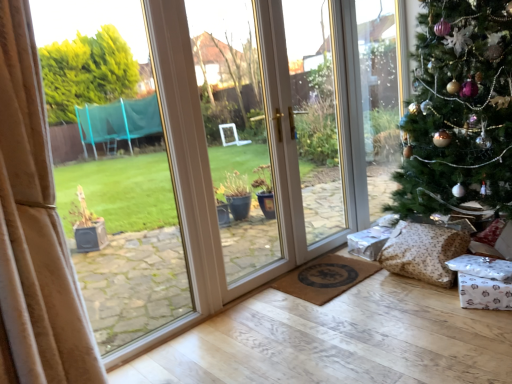
Question: From the image's perspective, does green textured christmas tree at right appear higher than brown textured doormat at lower center?

Choices:
 (A) yes
 (B) no

Answer: (A)

Question: Could you tell me if green textured christmas tree at right is facing brown textured doormat at lower center?

Choices:
 (A) no
 (B) yes

Answer: (A)

Question: Can you confirm if green textured christmas tree at right is bigger than brown textured doormat at lower center?

Choices:
 (A) yes
 (B) no

Answer: (A)

Question: From the image's perspective, is green textured christmas tree at right below brown textured doormat at lower center?

Choices:
 (A) no
 (B) yes

Answer: (A)

Question: Considering the relative positions of green textured christmas tree at right and brown textured doormat at lower center in the image provided, is green textured christmas tree at right to the right of brown textured doormat at lower center from the viewer's perspective?

Choices:
 (A) no
 (B) yes

Answer: (B)

Question: From the image's perspective, is green textured christmas tree at right positioned above or below brown textured pillow at lower right?

Choices:
 (A) above
 (B) below

Answer: (A)

Question: Is point (503, 48) closer or farther from the camera than point (394, 235)?

Choices:
 (A) closer
 (B) farther

Answer: (A)

Question: Choose the correct answer: Is green textured christmas tree at right inside brown textured pillow at lower right or outside it?

Choices:
 (A) outside
 (B) inside

Answer: (A)

Question: Considering the positions of green textured christmas tree at right and brown textured pillow at lower right in the image, is green textured christmas tree at right wider or thinner than brown textured pillow at lower right?

Choices:
 (A) thin
 (B) wide

Answer: (B)

Question: Looking at their shapes, would you say green textured christmas tree at right is wider or thinner than brown textured doormat at lower center?

Choices:
 (A) wide
 (B) thin

Answer: (A)

Question: From a real-world perspective, relative to brown textured doormat at lower center, is green textured christmas tree at right vertically above or below?

Choices:
 (A) above
 (B) below

Answer: (A)

Question: Looking at the image, does green textured christmas tree at right seem bigger or smaller compared to brown textured doormat at lower center?

Choices:
 (A) small
 (B) big

Answer: (B)

Question: Relative to brown textured doormat at lower center, is green textured christmas tree at right in front or behind?

Choices:
 (A) behind
 (B) front

Answer: (B)

Question: Is brown textured doormat at lower center to the left or to the right of green textured christmas tree at right in the image?

Choices:
 (A) right
 (B) left

Answer: (B)

Question: Is point (362, 271) closer or farther from the camera than point (434, 99)?

Choices:
 (A) closer
 (B) farther

Answer: (B)